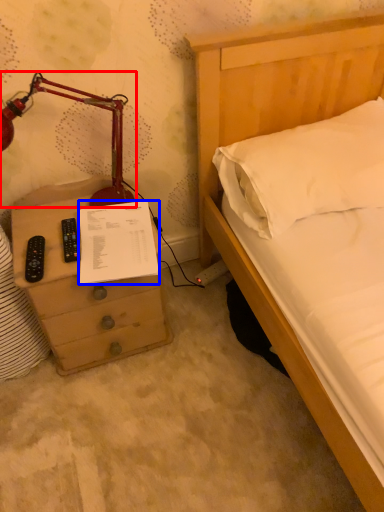
Question: Which of the following is the closest to the observer, lamp (highlighted by a red box) or document (highlighted by a blue box)?

Choices:
 (A) lamp
 (B) document

Answer: (A)